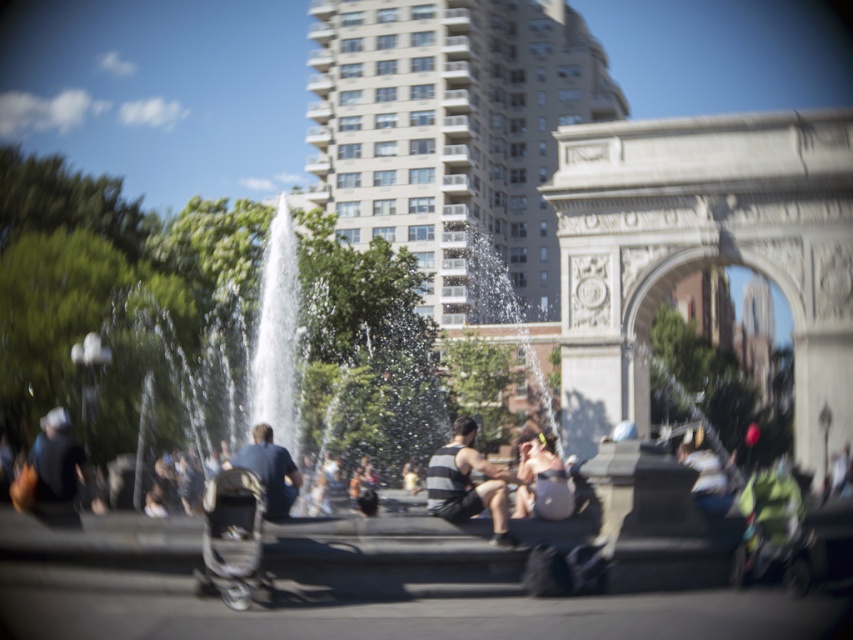
Identify the location of silver metallic baby carriage at lower left. This screenshot has height=640, width=853. (234, 536).

I want to click on silver metallic baby carriage at lower left, so click(234, 536).

Measure the distance from dark gray fabric jacket at lower left to dark blue shirt at center.

They are 9.96 meters apart.

Where is `dark gray fabric jacket at lower left`? The width and height of the screenshot is (853, 640). dark gray fabric jacket at lower left is located at coordinates (55, 470).

Between point (230, 580) and point (276, 470), which one is positioned in front?

Point (230, 580)

What are the coordinates of `silver metallic baby carriage at lower left` in the screenshot? It's located at (234, 536).